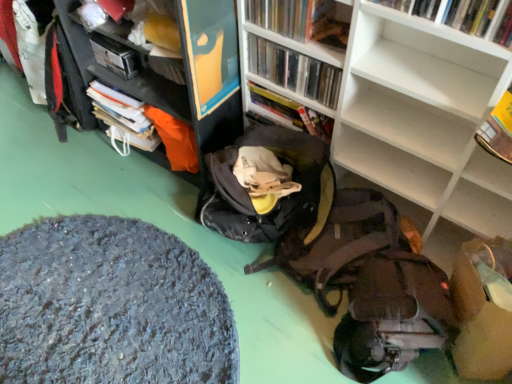
Question: From a real-world perspective, relative to matte brown backpack at lower right, is white matte bookcase at center vertically above or below?

Choices:
 (A) below
 (B) above

Answer: (B)

Question: Considering their positions, is white matte bookcase at center located in front of or behind matte brown backpack at lower right?

Choices:
 (A) front
 (B) behind

Answer: (A)

Question: Estimate the real-world distances between objects in this image. Which object is farther from the textured gray rug at lower left?

Choices:
 (A) white matte bookcase at center
 (B) dark gray fabric bean bag chair at center
 (C) hardcover book at upper left
 (D) clear plastic case at upper center, positioned as the 3th book in front-to-back order
 (E) matte brown backpack at lower right

Answer: (D)

Question: Estimate the real-world distances between objects in this image. Which object is closer to the matte black cabinet at upper left?

Choices:
 (A) white matte bookcase at center
 (B) clear plastic case at upper center, positioned as the 3th book in front-to-back order
 (C) matte brown backpack at lower right
 (D) hardcover book at upper right, the 1th book when ordered from front to back
 (E) matte plastic book at upper center, arranged as the 2th book when viewed from the front

Answer: (B)